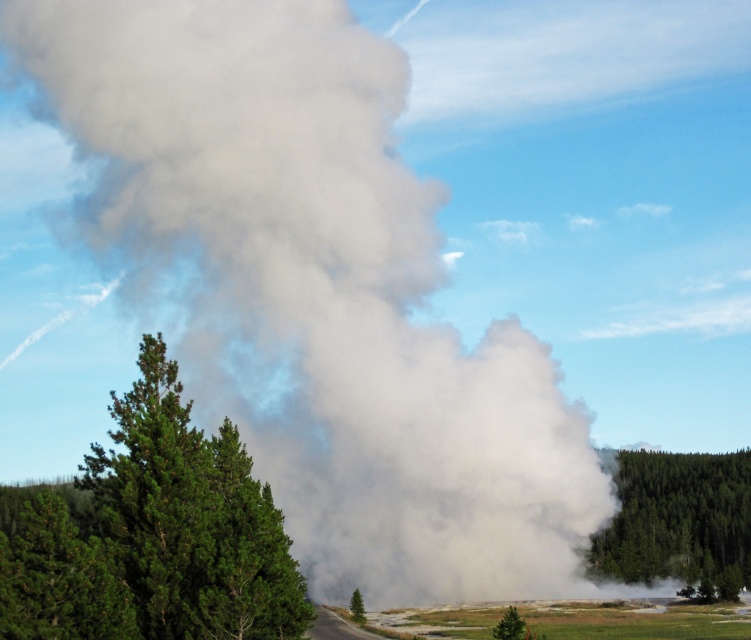
Which is behind, point (596, 99) or point (730, 481)?

Point (596, 99)

Is white fluffy cloud at upper center taller than green textured tree at lower right?

Correct, white fluffy cloud at upper center is much taller as green textured tree at lower right.

Describe the element at coordinates (559, 52) in the screenshot. I see `white fluffy cloud at upper center` at that location.

Where is `white fluffy cloud at upper center`? The height and width of the screenshot is (640, 751). white fluffy cloud at upper center is located at coordinates (559, 52).

Who is taller, green textured tree at left or green matte tree at center?

green textured tree at left is taller.

You are a GUI agent. You are given a task and a screenshot of the screen. Output one action in this format:
    pyautogui.click(x=<x>, y=<y>)
    Task: Click on the green textured tree at left
    This screenshot has height=640, width=751.
    Given the screenshot: What is the action you would take?
    pyautogui.click(x=155, y=536)

Where is `green textured tree at left`? green textured tree at left is located at coordinates (155, 536).

Is white fluffy cloud at upper center further to the viewer compared to green matte tree at center?

That is True.

Is point (664, 44) less distant than point (354, 604)?

No, it is not.

Does point (448, 83) lie behind point (359, 602)?

Yes.

I want to click on white fluffy cloud at upper center, so click(x=559, y=52).